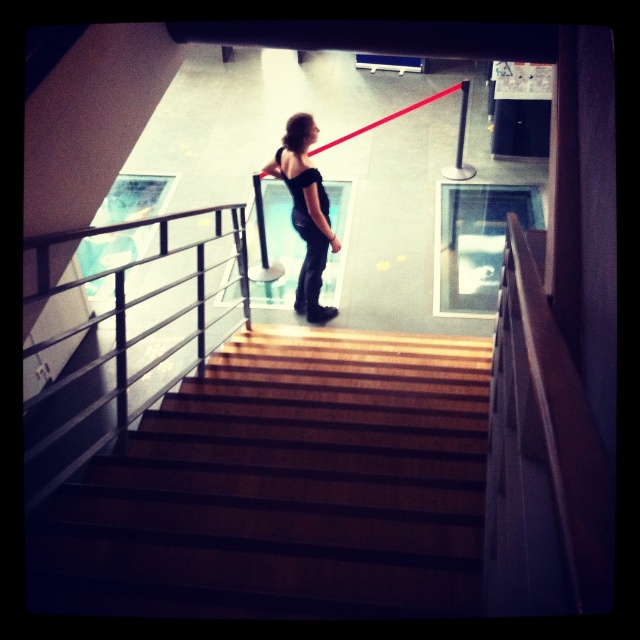
You are a delivery person trying to carry a large package that is 1.5 meters wide. You need to walk down the wooden stairs at center while wearing the black leather dress at center. Will the dress interfere with your ability to navigate the stairs safely?

The wooden stairs at center are wider than the black leather dress at center, so the dress should not interfere with navigating the stairs safely as there is enough space.

You are a delivery person trying to navigate through the staircase area. You see the metallic silver balustrade at center and the black leather dress at center. Which object is wider, and could this affect your path?

The metallic silver balustrade at center is wider than the black leather dress at center, so it might require more space when navigating around it.

You are standing at the bottom of the wooden stairs at center and want to reach the black leather dress at center. Which direction should you move to get closer to the dress?

Since the wooden stairs at center is closer to the viewer than the black leather dress at center, you should move forward towards the dress to get closer to it.